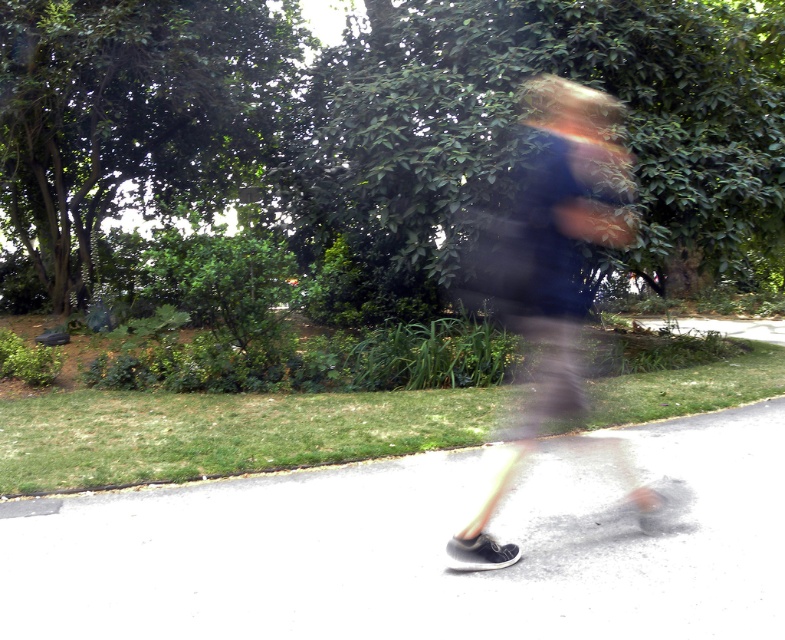
Question: Can you confirm if white asphalt at center is thinner than dark blue fabric at center?

Choices:
 (A) yes
 (B) no

Answer: (B)

Question: Is white asphalt at center positioned behind dark blue fabric at center?

Choices:
 (A) no
 (B) yes

Answer: (A)

Question: Can you confirm if white asphalt at center is positioned below dark blue fabric at center?

Choices:
 (A) no
 (B) yes

Answer: (B)

Question: Which of the following is the closest to the observer?

Choices:
 (A) white asphalt at center
 (B) dark blue fabric at center

Answer: (A)